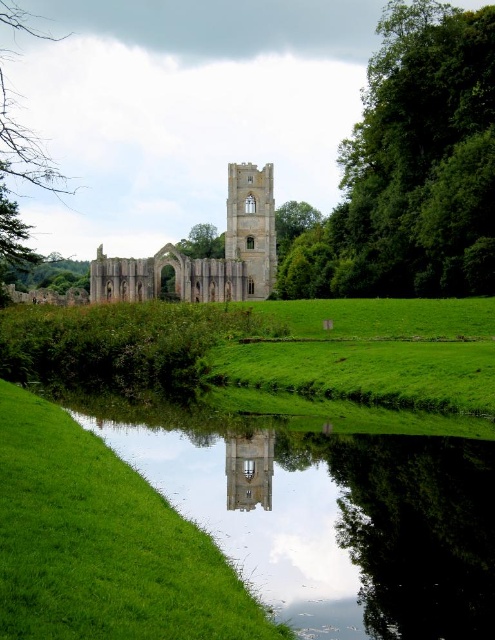
Is green grassy at lower left bigger than green leafy tree at upper left?

Yes, green grassy at lower left is bigger than green leafy tree at upper left.

Does point (68, 483) come in front of point (48, 179)?

Yes, it is.

Find the location of a particular element. Image resolution: width=495 pixels, height=640 pixels. green grassy at lower left is located at coordinates (102, 545).

Is brown stone ruins at center to the right of transparent glass tower at center from the viewer's perspective?

In fact, brown stone ruins at center is to the left of transparent glass tower at center.

Locate an element on the screen. Image resolution: width=495 pixels, height=640 pixels. brown stone ruins at center is located at coordinates (205, 257).

Between point (248, 224) and point (257, 438), which one is positioned in front?

Point (257, 438) is more forward.

The image size is (495, 640). I want to click on brown stone ruins at center, so click(205, 257).

Between brown stone ruins at center and green leafy tree at center, which one has more height?

With more height is brown stone ruins at center.

Is brown stone ruins at center positioned at the back of green leafy tree at center?

That is False.

Is point (216, 262) positioned behind point (185, 253)?

That is False.

Identify the location of brown stone ruins at center. (205, 257).